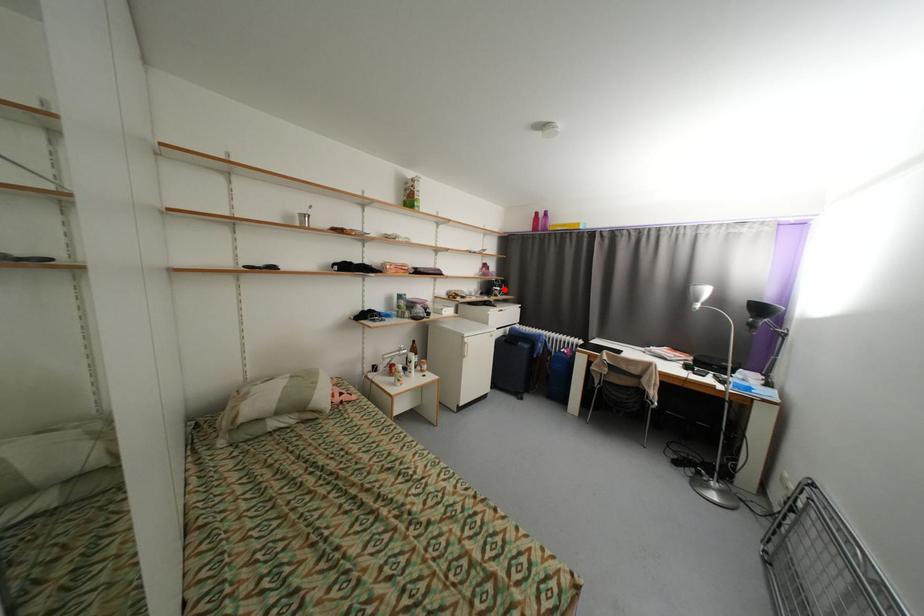
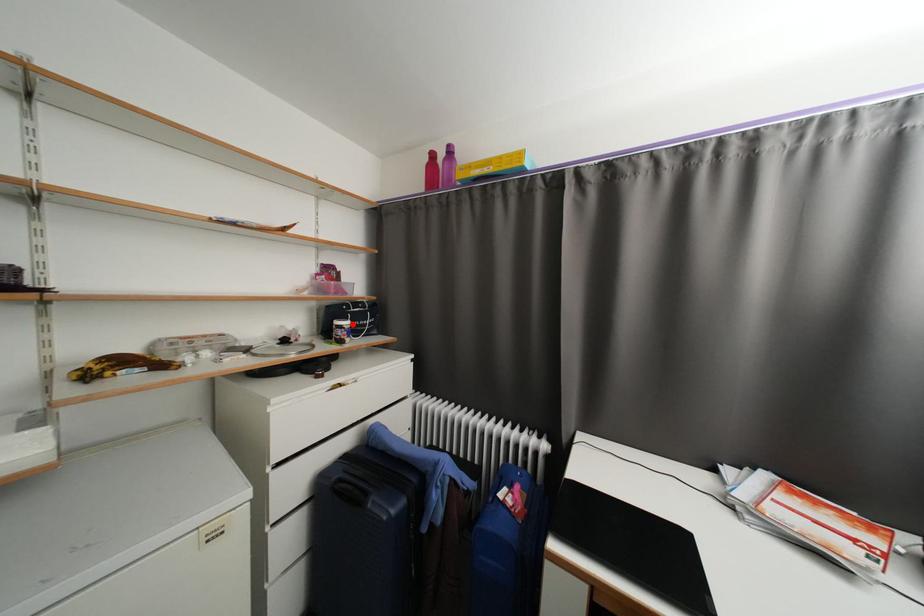
I am providing you with two images of the same scene from different viewpoints. A red point is marked on the first image and another point is marked on the second image. Do the highlighted points in image1 and image2 indicate the same real-world spot?

Yes